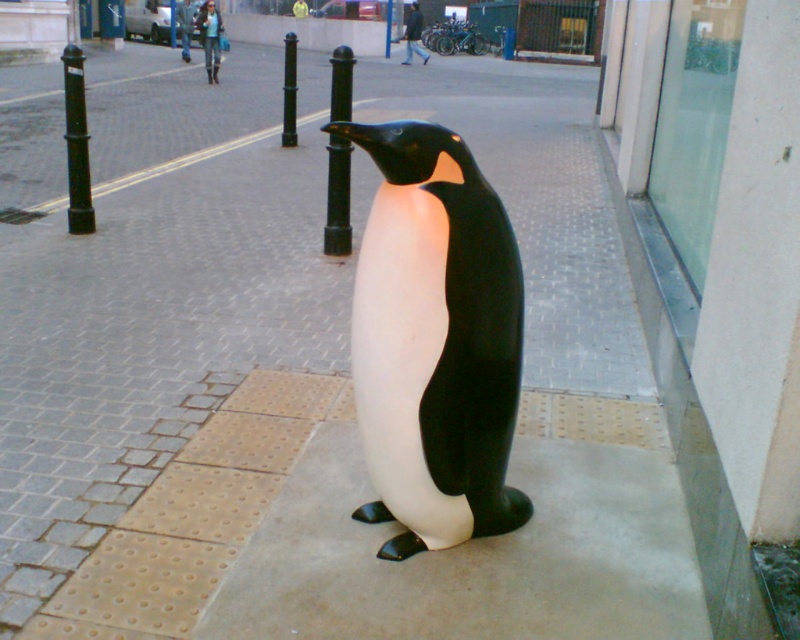
Looking at this image, is white matte penguin at center bigger than black metal pole at center?

Actually, white matte penguin at center might be smaller than black metal pole at center.

Measure the distance between white matte penguin at center and black metal pole at center.

white matte penguin at center and black metal pole at center are 6.87 meters apart from each other.

The image size is (800, 640). Describe the element at coordinates (436, 340) in the screenshot. I see `white matte penguin at center` at that location.

Identify the location of white matte penguin at center. The image size is (800, 640). (436, 340).

Is black polished metal pole at center bigger than black metal pole at left?

Incorrect, black polished metal pole at center is not larger than black metal pole at left.

Is point (346, 182) farther from viewer compared to point (72, 72)?

No.

Who is more distant from viewer, [333,136] or [84,196]?

Point [84,196]

Find the location of a particular element. Image resolution: width=800 pixels, height=640 pixels. black polished metal pole at center is located at coordinates (337, 198).

Which is behind, point (502, 508) or point (386, 36)?

Point (386, 36)

Measure the distance between point (458, 480) and camera.

They are 2.11 meters apart.

Locate an element on the screen. This screenshot has width=800, height=640. white matte penguin at center is located at coordinates (436, 340).